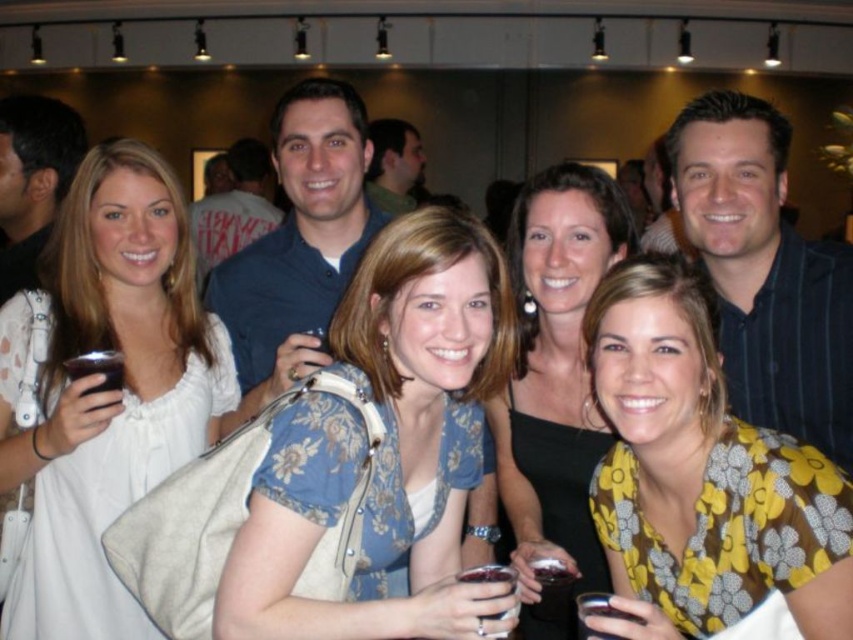
You are a photographer at the event and want to ensure all guests are visible in the group photo. Since the white matte dress at center and the black fabric dress at center are both at the center, which dress should be adjusted to avoid blocking the other?

The white matte dress at center is shorter than the black fabric dress at center. To avoid blocking, the taller black fabric dress at center should be moved back slightly so the shorter white matte dress at center can be seen fully.

Looking at this image, you are at a party and want to take a photo with the white matte dress at center and the translucent glass wine at lower center in the background. Since you have a small camera, you can only focus on one object. Which object should you focus on to ensure it appears larger in the photo?

You should focus on the white matte dress at center because it is bigger than the translucent glass wine at lower center, so it will appear larger in the photo.

You are a photographer adjusting the camera focus on the two dresses in the center of the image. The white matte dress at center and the black fabric dress at center. The camera has a depth of field that can cover 30 inches. Will both dresses be in focus at the same time?

The white matte dress at center and the black fabric dress at center are 29.34 inches apart. Since the distance between them is less than the camera depth of field of 30 inches, both dresses will be in focus simultaneously.